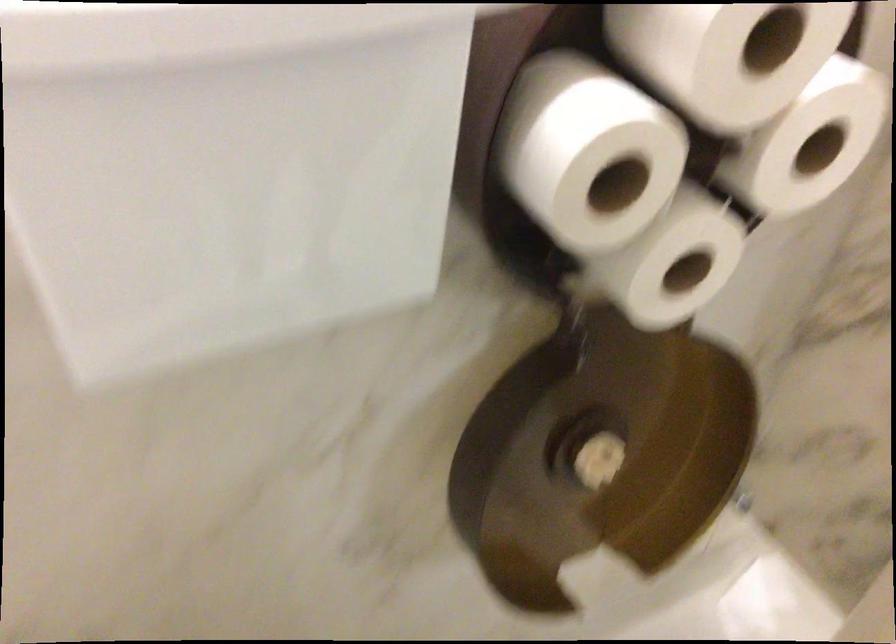
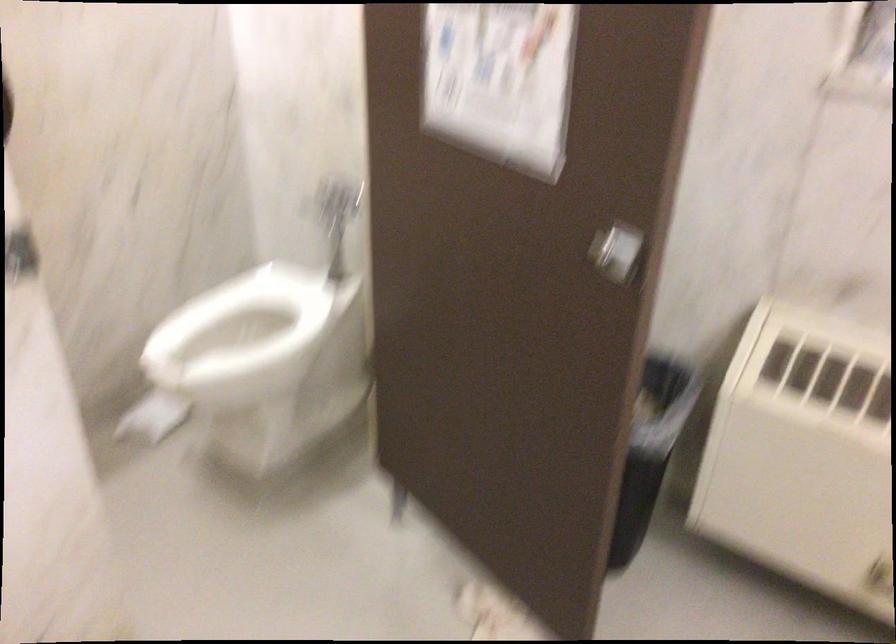
In a continuous first-person perspective shot, in which direction is the camera moving?

The cameraman moved toward right, backward.